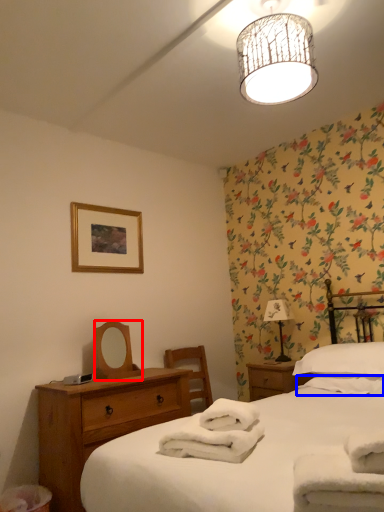
Question: Which object is further to the camera taking this photo, mirror (highlighted by a red box) or bath towel (highlighted by a blue box)?

Choices:
 (A) mirror
 (B) bath towel

Answer: (A)